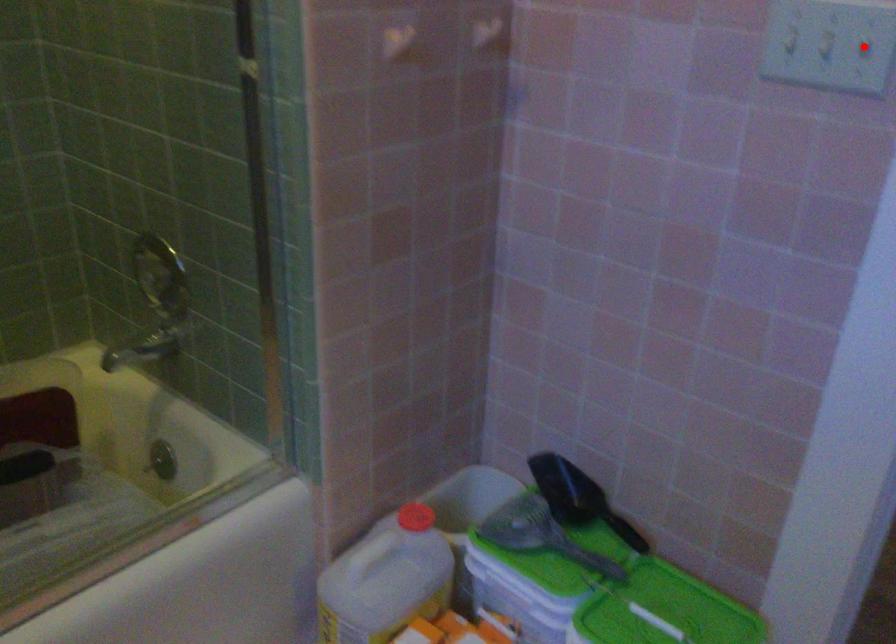
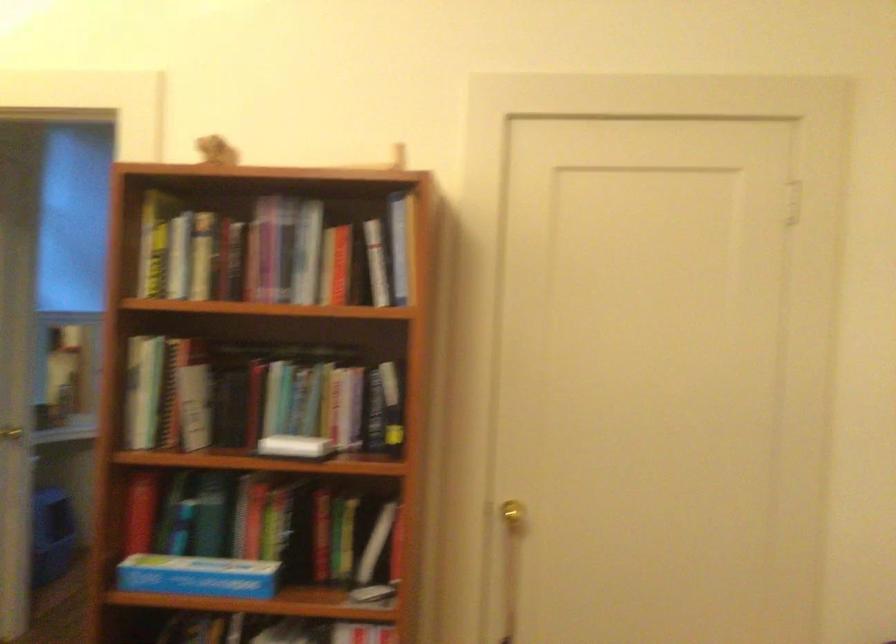
Question: I am providing you with two images of the same scene from different viewpoints. A red point is marked on the first image. At the location where the point appears in image 1, is it still visible in image 2?

Choices:
 (A) Yes
 (B) No

Answer: (B)